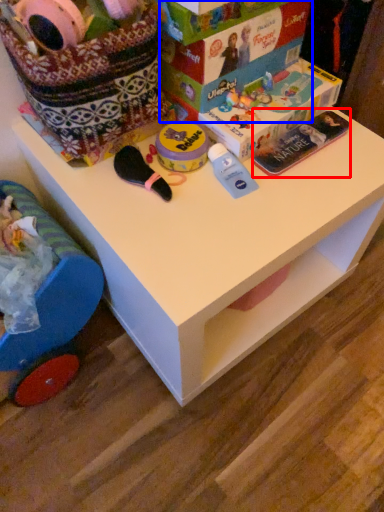
Question: Which object appears farthest to the camera in this image, magazine (highlighted by a red box) or storage box (highlighted by a blue box)?

Choices:
 (A) magazine
 (B) storage box

Answer: (A)